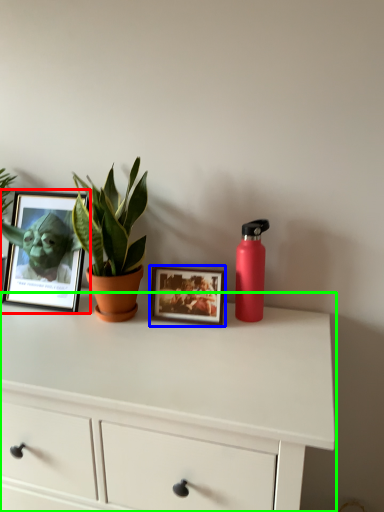
Question: Based on their relative distances, which object is nearer to picture frame (highlighted by a red box)? Choose from picture frame (highlighted by a blue box) and chest of drawers (highlighted by a green box).

Choices:
 (A) picture frame
 (B) chest of drawers

Answer: (A)